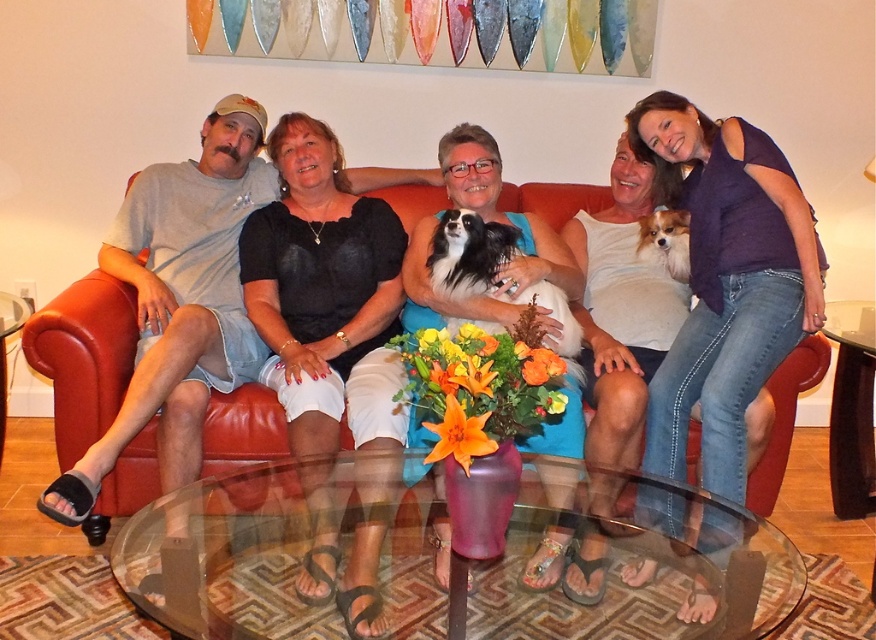
Question: Which point is closer to the camera?

Choices:
 (A) (663, 234)
 (B) (95, 436)

Answer: (B)

Question: Which object appears closest to the camera in this image?

Choices:
 (A) leather couch at center
 (B) transparent glass table at center
 (C) fluffy white dog at upper right
 (D) black silky dog at center

Answer: (B)

Question: Which of these objects is positioned closest to the blue denim jeans at right?

Choices:
 (A) fluffy white dog at upper right
 (B) transparent glass table at center

Answer: (A)

Question: Is black velvet blouse at center closer to the viewer compared to fluffy white dog at upper right?

Choices:
 (A) no
 (B) yes

Answer: (B)

Question: Considering the relative positions of blue denim jeans at right and black silky dog at center in the image provided, where is blue denim jeans at right located with respect to black silky dog at center?

Choices:
 (A) below
 (B) above

Answer: (B)

Question: Is transparent glass table at center smaller than fluffy white dog at upper right?

Choices:
 (A) yes
 (B) no

Answer: (B)